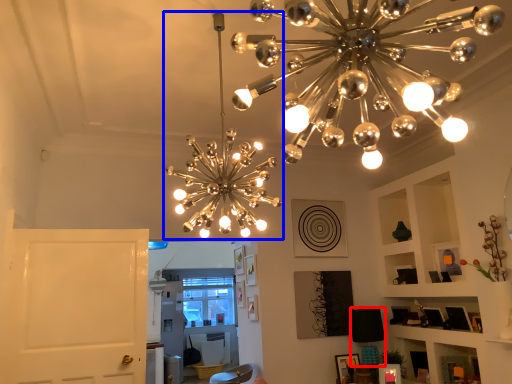
Question: Which point is closer to the camera, lamp (highlighted by a red box) or lamp (highlighted by a blue box)?

Choices:
 (A) lamp
 (B) lamp

Answer: (B)